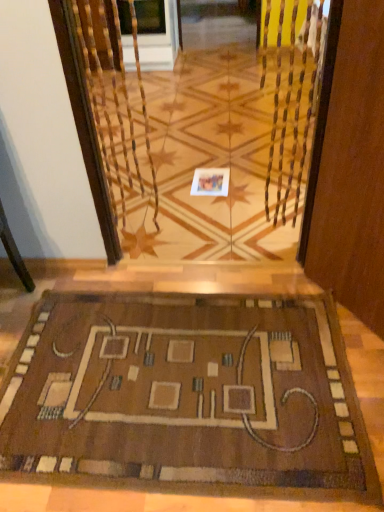
Question: In terms of width, does white paper at center look wider or thinner when compared to brown woven mat at lower center?

Choices:
 (A) thin
 (B) wide

Answer: (A)

Question: From a real-world perspective, is white paper at center positioned above or below brown woven mat at lower center?

Choices:
 (A) below
 (B) above

Answer: (A)

Question: Which object is the closest to the transparent glass door at center?

Choices:
 (A) white paper at center
 (B) brown woven mat at lower center

Answer: (A)

Question: Which is nearer to the white paper at center?

Choices:
 (A) brown woven mat at lower center
 (B) transparent glass door at center

Answer: (B)